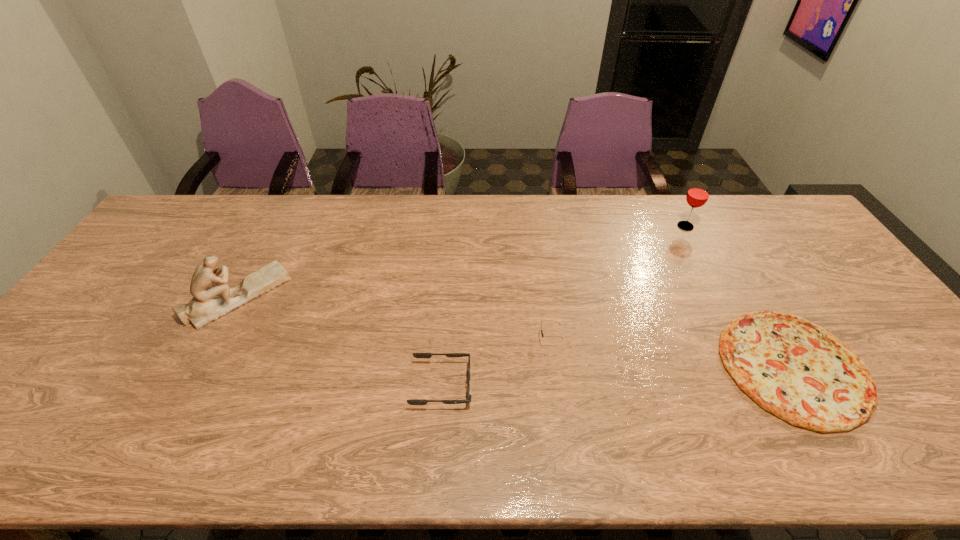
Identify the location of glass. This screenshot has width=960, height=540. (698, 194).

You are a GUI agent. You are given a task and a screenshot of the screen. Output one action in this format:
    pyautogui.click(x=<x>, y=<y>)
    Task: Click on the figurine
    Image resolution: width=960 pixels, height=540 pixels.
    Given the screenshot: What is the action you would take?
    point(212,298)

Identify the location of the farther sunglasses. The height and width of the screenshot is (540, 960). (542, 334).

What are the coordinates of `the third tallest object` in the screenshot? It's located at (542, 334).

In order to click on the nearer sunglasses in this screenshot , I will do `click(417, 355)`.

The image size is (960, 540). What are the coordinates of `the fourth object from right to left` in the screenshot? It's located at (417, 355).

Image resolution: width=960 pixels, height=540 pixels. In order to click on pizza in this screenshot , I will do `click(797, 370)`.

Locate an element on the screen. This screenshot has width=960, height=540. blank area located on the left of the farthest object is located at coordinates (568, 226).

This screenshot has height=540, width=960. What are the coordinates of `vacant space located 0.280m on the front-facing side of the figurine` in the screenshot? It's located at (382, 296).

This screenshot has height=540, width=960. I want to click on vacant space located in front of the lenses of the right sunglasses, so click(x=485, y=340).